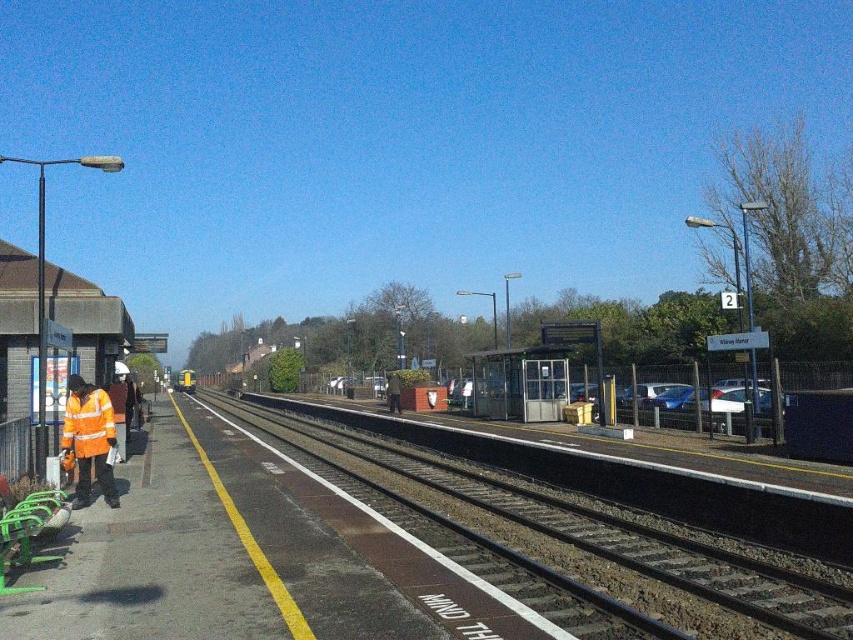
Can you confirm if black asphalt track at center is shorter than high-visibility orange jacket at left?

No.

Does black asphalt track at center appear over high-visibility orange jacket at left?

Incorrect, black asphalt track at center is not positioned above high-visibility orange jacket at left.

Does point (380, 449) come farther from viewer compared to point (103, 435)?

Yes, it is behind point (103, 435).

I want to click on black asphalt track at center, so click(x=573, y=531).

Does high-visibility orange jacket at left have a lesser width compared to high visibility orange safety vest at left?

Incorrect, high-visibility orange jacket at left's width is not less than high visibility orange safety vest at left's.

Is high-visibility orange jacket at left closer to camera compared to high visibility orange safety vest at left?

Yes, it is in front of high visibility orange safety vest at left.

Which is behind, point (96, 406) or point (100, 433)?

Positioned behind is point (100, 433).

Where is `high-visibility orange jacket at left`? This screenshot has width=853, height=640. high-visibility orange jacket at left is located at coordinates (90, 440).

Who is more forward, [757,579] or [111,417]?

Positioned in front is point [757,579].

Is point (705, 616) less distant than point (82, 435)?

Yes.

Who is more distant from viewer, (x=390, y=488) or (x=94, y=429)?

The point (x=390, y=488) is behind.

Locate an element on the screen. This screenshot has width=853, height=640. black asphalt track at center is located at coordinates (573, 531).